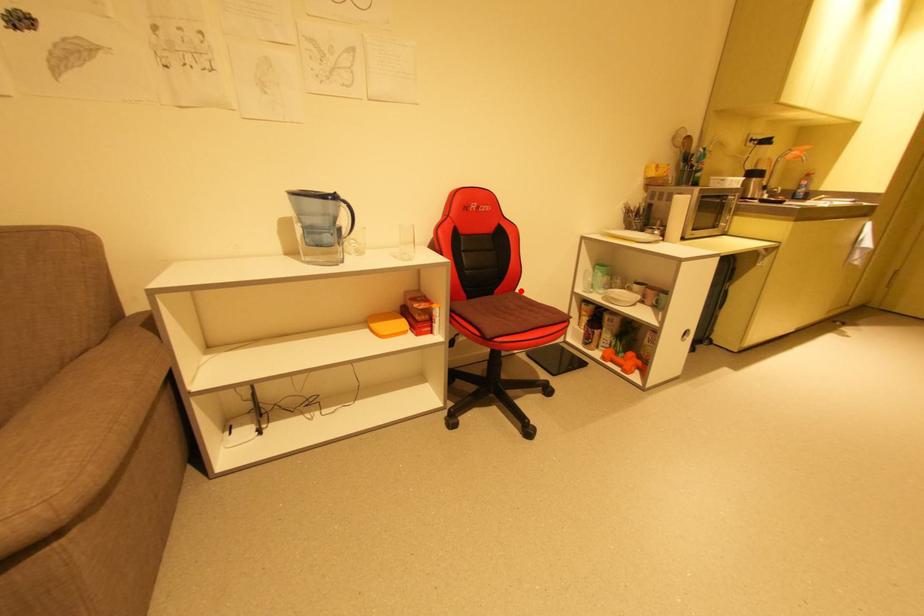
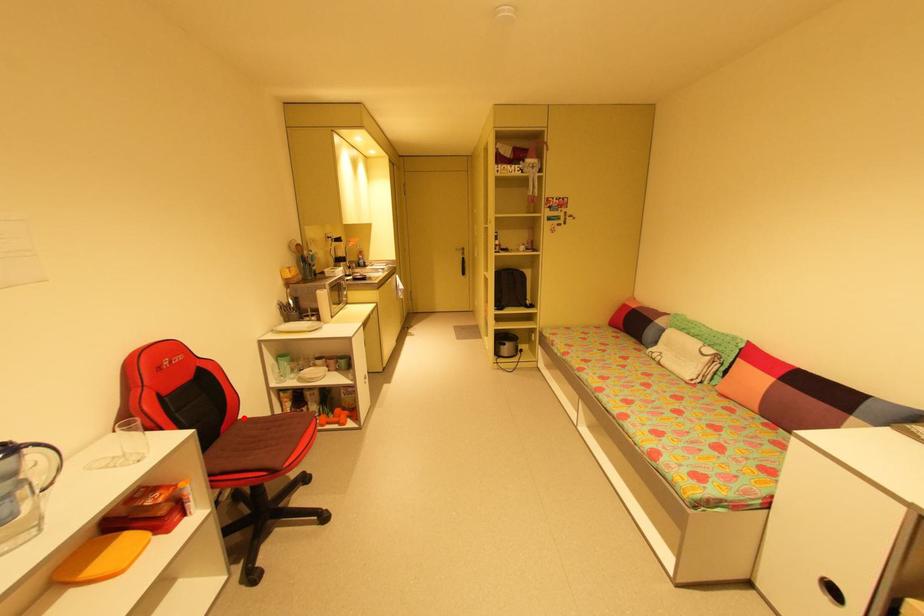
I am providing you with two images of the same scene from different viewpoints. A red point is marked on the first image and another point is marked on the second image. Do the highlighted points in image1 and image2 indicate the same real-world spot?

Yes